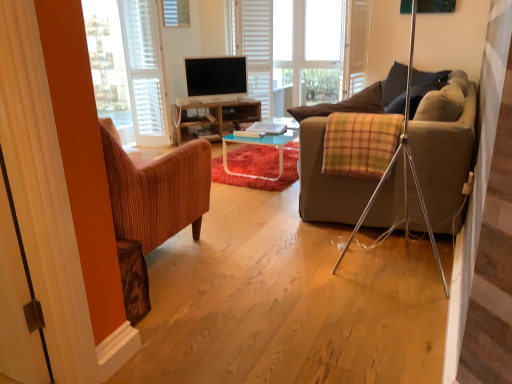
Question: Does matte black tv at center lie in front of dark blue fabric pillow at upper right?

Choices:
 (A) yes
 (B) no

Answer: (B)

Question: Can we say matte black tv at center lies outside dark blue fabric pillow at upper right?

Choices:
 (A) no
 (B) yes

Answer: (B)

Question: From the image's perspective, is matte black tv at center under dark blue fabric pillow at upper right?

Choices:
 (A) no
 (B) yes

Answer: (A)

Question: From a real-world perspective, is matte black tv at center physically above dark blue fabric pillow at upper right?

Choices:
 (A) yes
 (B) no

Answer: (B)

Question: Is matte black tv at center at the right side of dark blue fabric pillow at upper right?

Choices:
 (A) yes
 (B) no

Answer: (B)

Question: In terms of width, does matte black tv at center look wider or thinner when compared to white matte blinds at upper center?

Choices:
 (A) wide
 (B) thin

Answer: (B)

Question: Is matte black tv at center in front of or behind white matte blinds at upper center in the image?

Choices:
 (A) behind
 (B) front

Answer: (A)

Question: From a real-world perspective, relative to white matte blinds at upper center, is matte black tv at center vertically above or below?

Choices:
 (A) below
 (B) above

Answer: (A)

Question: Is point (209, 76) positioned closer to the camera than point (153, 67)?

Choices:
 (A) farther
 (B) closer

Answer: (A)

Question: Based on their sizes in the image, would you say white wood bay window at center is bigger or smaller than matte black tv at center?

Choices:
 (A) big
 (B) small

Answer: (A)

Question: Is white wood bay window at center in front of or behind matte black tv at center in the image?

Choices:
 (A) front
 (B) behind

Answer: (A)

Question: Is point (280, 31) positioned closer to the camera than point (229, 79)?

Choices:
 (A) closer
 (B) farther

Answer: (B)

Question: In terms of height, does white wood bay window at center look taller or shorter compared to matte black tv at center?

Choices:
 (A) short
 (B) tall

Answer: (B)

Question: Relative to white fabric curtain at left, is white matte blinds at upper center in front or behind?

Choices:
 (A) behind
 (B) front

Answer: (A)

Question: From the image's perspective, relative to white fabric curtain at left, is white matte blinds at upper center above or below?

Choices:
 (A) below
 (B) above

Answer: (B)